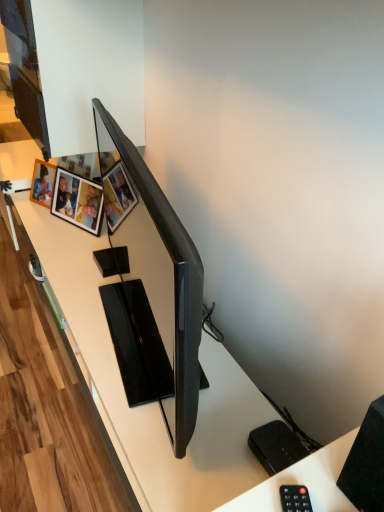
Locate an element on the screen. black plastic remote at lower right is located at coordinates (295, 498).

At what (x,y) coordinates should I click in order to perform the action: click on wooden photo frame at upper left, acting as the first picture frame starting from the right. Please return your answer as a coordinate pair (x, y). Looking at the image, I should click on (78, 201).

Describe the element at coordinates (366, 463) in the screenshot. I see `black matte speaker at lower right` at that location.

Describe the element at coordinates (159, 283) in the screenshot. I see `matte black tv at center` at that location.

Where is `wooden photo frame at upper left, which is counted as the first picture frame, starting from the left`? wooden photo frame at upper left, which is counted as the first picture frame, starting from the left is located at coordinates (42, 183).

Find the location of a particular element. computer desk that is in front of the wooden photo frame at upper left, acting as the first picture frame starting from the right is located at coordinates (303, 482).

Which object is further away from the camera, wooden photo frame at upper left, acting as the first picture frame starting from the right, or white plastic remote control at lower right?

wooden photo frame at upper left, acting as the first picture frame starting from the right, is more distant.

Is wooden photo frame at upper left, acting as the first picture frame starting from the right, far from white plastic remote control at lower right?

Yes, wooden photo frame at upper left, acting as the first picture frame starting from the right, and white plastic remote control at lower right are quite far apart.

From the image's perspective, between wooden photo frame at upper left, acting as the first picture frame starting from the right, and white plastic remote control at lower right, which one is located above?

wooden photo frame at upper left, acting as the first picture frame starting from the right, appears higher in the image.

Is black matte speaker at lower right bigger than matte black tv at center?

Actually, black matte speaker at lower right might be smaller than matte black tv at center.

Does point (365, 482) come closer to viewer compared to point (173, 387)?

Yes, point (365, 482) is in front of point (173, 387).

Would you say black matte speaker at lower right is inside or outside matte black tv at center?

black matte speaker at lower right lies outside matte black tv at center.

Is black matte speaker at lower right next to matte black tv at center?

They are not placed beside each other.

Can you confirm if black matte speaker at lower right is wider than white plastic remote control at lower right?

Incorrect, the width of black matte speaker at lower right does not surpass that of white plastic remote control at lower right.

Does point (366, 500) lie in front of point (351, 443)?

That is True.

Is black matte speaker at lower right bigger or smaller than white plastic remote control at lower right?

Clearly, black matte speaker at lower right is larger in size than white plastic remote control at lower right.

Consider the image. Would you say black matte speaker at lower right is inside or outside white plastic remote control at lower right?

black matte speaker at lower right is located beyond the bounds of white plastic remote control at lower right.

Does matte black tv at center appear on the right side of black matte speaker at lower right?

No, matte black tv at center is not to the right of black matte speaker at lower right.

Which point is more distant from viewer, (109, 119) or (373, 461)?

The point (109, 119) is behind.

Considering the relative sizes of matte black tv at center and black matte speaker at lower right in the image provided, is matte black tv at center taller than black matte speaker at lower right?

Correct, matte black tv at center is much taller as black matte speaker at lower right.

Would you say matte black tv at center is outside black matte speaker at lower right?

matte black tv at center lies outside black matte speaker at lower right's area.

Consider the image. Is wooden photo frame at upper left, which is counted as the first picture frame, starting from the left, far from wooden photo frame at upper left, acting as the first picture frame starting from the right?

No, there isn't a large distance between wooden photo frame at upper left, which is counted as the first picture frame, starting from the left, and wooden photo frame at upper left, acting as the first picture frame starting from the right.

You are a GUI agent. You are given a task and a screenshot of the screen. Output one action in this format:
    pyautogui.click(x=<x>, y=<y>)
    Task: Click on the picture frame behind the wooden photo frame at upper left, acting as the first picture frame starting from the right
    
    Given the screenshot: What is the action you would take?
    pyautogui.click(x=42, y=183)

Is wooden photo frame at upper left, which is counted as the first picture frame, starting from the left, looking in the opposite direction of wooden photo frame at upper left, the 2th picture frame in the left-to-right sequence?

No, wooden photo frame at upper left, the 2th picture frame in the left-to-right sequence, is not at the back of wooden photo frame at upper left, which is counted as the first picture frame, starting from the left.

How many degrees apart are the facing directions of wooden photo frame at upper left, which is the second picture frame in right-to-left order, and wooden photo frame at upper left, acting as the first picture frame starting from the right?

3.55 degrees separate the facing orientations of wooden photo frame at upper left, which is the second picture frame in right-to-left order, and wooden photo frame at upper left, acting as the first picture frame starting from the right.

Which is correct: wooden photo frame at upper left, which is the second picture frame in right-to-left order, is inside white plastic remote control at lower right, or outside of it?

wooden photo frame at upper left, which is the second picture frame in right-to-left order, exists outside the volume of white plastic remote control at lower right.

From the image's perspective, which is above, wooden photo frame at upper left, which is counted as the first picture frame, starting from the left, or white plastic remote control at lower right?

wooden photo frame at upper left, which is counted as the first picture frame, starting from the left, from the image's perspective.

Is wooden photo frame at upper left, which is the second picture frame in right-to-left order, far away from white plastic remote control at lower right?

Indeed, wooden photo frame at upper left, which is the second picture frame in right-to-left order, is not near white plastic remote control at lower right.

Can you tell me how much wooden photo frame at upper left, which is counted as the first picture frame, starting from the left, and white plastic remote control at lower right differ in facing direction?

The angular difference between wooden photo frame at upper left, which is counted as the first picture frame, starting from the left, and white plastic remote control at lower right is 27.9 degrees.

Visually, is black plastic remote at lower right positioned to the left or to the right of wooden photo frame at upper left, acting as the first picture frame starting from the right?

black plastic remote at lower right is to the right of wooden photo frame at upper left, acting as the first picture frame starting from the right.

Can you confirm if black plastic remote at lower right is bigger than wooden photo frame at upper left, the 2th picture frame in the left-to-right sequence?

No.

Is point (284, 500) closer to camera compared to point (92, 189)?

Yes, point (284, 500) is in front of point (92, 189).

How far apart are black plastic remote at lower right and wooden photo frame at upper left, acting as the first picture frame starting from the right?

black plastic remote at lower right and wooden photo frame at upper left, acting as the first picture frame starting from the right, are 1.47 meters apart.

What are the coordinates of `the 2nd picture frame above the white plastic remote control at lower right (from a real-world perspective)` in the screenshot? It's located at (78, 201).

This screenshot has width=384, height=512. I want to click on speaker on the right of the matte black tv at center, so click(x=366, y=463).

When comparing their distances from wooden photo frame at upper left, which is the second picture frame in right-to-left order, does black matte speaker at lower right or white plastic remote control at lower right seem further?

black matte speaker at lower right is positioned further to the anchor wooden photo frame at upper left, which is the second picture frame in right-to-left order.

Estimate the real-world distances between objects in this image. Which object is further from wooden photo frame at upper left, which is the second picture frame in right-to-left order, matte black tv at center or black matte speaker at lower right?

Among the two, black matte speaker at lower right is located further to wooden photo frame at upper left, which is the second picture frame in right-to-left order.

From the image, which object appears to be farther from wooden photo frame at upper left, which is the second picture frame in right-to-left order, matte black tv at center or wooden photo frame at upper left, acting as the first picture frame starting from the right?

Among the two, matte black tv at center is located further to wooden photo frame at upper left, which is the second picture frame in right-to-left order.

Which object lies nearer to the anchor point black matte speaker at lower right, black plastic remote at lower right or matte black tv at center?

black plastic remote at lower right lies closer to black matte speaker at lower right than the other object.

Based on the photo, looking at the image, which one is located further to black matte speaker at lower right, white plastic remote control at lower right or black plastic remote at lower right?

Based on the image, black plastic remote at lower right appears to be further to black matte speaker at lower right.

Which object lies nearer to the anchor point wooden photo frame at upper left, which is the second picture frame in right-to-left order, black plastic remote at lower right or matte black tv at center?

Among the two, matte black tv at center is located nearer to wooden photo frame at upper left, which is the second picture frame in right-to-left order.

From the image, which object appears to be farther from wooden photo frame at upper left, the 2th picture frame in the left-to-right sequence, white plastic remote control at lower right or black plastic remote at lower right?

black plastic remote at lower right is positioned further to the anchor wooden photo frame at upper left, the 2th picture frame in the left-to-right sequence.

From the image, which object appears to be farther from wooden photo frame at upper left, which is the second picture frame in right-to-left order, black plastic remote at lower right or black matte speaker at lower right?

black matte speaker at lower right.

Locate an element on the screen. The width and height of the screenshot is (384, 512). computer desk between black matte speaker at lower right and wooden photo frame at upper left, acting as the first picture frame starting from the right, from front to back is located at coordinates (303, 482).

Identify the location of control between matte black tv at center and white plastic remote control at lower right in the vertical direction. The width and height of the screenshot is (384, 512). (295, 498).

The width and height of the screenshot is (384, 512). Find the location of `television between black plastic remote at lower right and wooden photo frame at upper left, which is counted as the first picture frame, starting from the left, in the front-back direction`. television between black plastic remote at lower right and wooden photo frame at upper left, which is counted as the first picture frame, starting from the left, in the front-back direction is located at coordinates (159, 283).

The image size is (384, 512). Identify the location of television between black matte speaker at lower right and wooden photo frame at upper left, the 2th picture frame in the left-to-right sequence, from front to back. (159, 283).